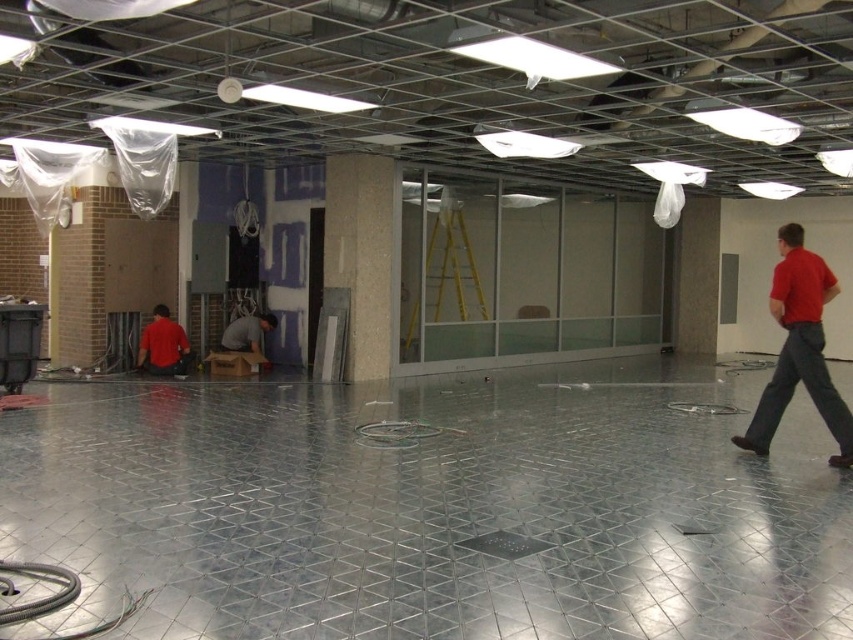
You are a construction worker in the scene. You need to choose a shirt that is bigger to cover your uniform. Which shirt should you pick between the red cotton shirt at right and the gray fabric shirt at center?

The red cotton shirt at right has a larger size compared to the gray fabric shirt at center, so you should pick the red cotton shirt at right.

You are standing in the center of the room. The coordinates of the center are at point 0.5, 0.5. Where is the matte red shirt at left located relative to your position? Is it to the left, right, above, or below?

The matte red shirt at left is located at point (161, 342). Since the center is at (426, 320), the shirt is slightly to the right and much lower than the center point. Therefore, it is to the right and below your position.

You are an inspector checking the construction site. You notice two workers wearing red shirts. The red cotton shirt at right and the matte red shirt at left. Based on their positions, which worker is closer to the ceiling lights?

The red cotton shirt at right is located above the matte red shirt at left, so the worker in the red cotton shirt at right is closer to the ceiling lights.